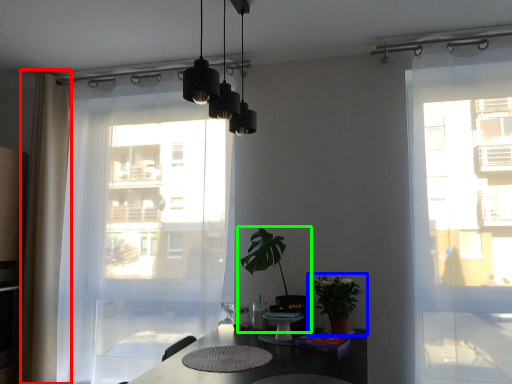
Question: Based on their relative distances, which object is nearer to curtain (highlighted by a red box)? Choose from houseplant (highlighted by a blue box) and houseplant (highlighted by a green box).

Choices:
 (A) houseplant
 (B) houseplant

Answer: (B)